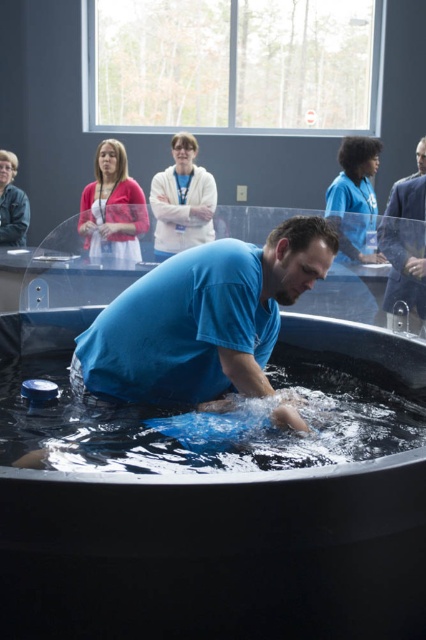
Who is positioned more to the right, matte pink cardigan at upper left or blue smooth shirt at right?

Positioned to the right is blue smooth shirt at right.

Is matte pink cardigan at upper left taller than blue smooth shirt at right?

Incorrect, matte pink cardigan at upper left's height is not larger of blue smooth shirt at right's.

Which is in front, point (92, 198) or point (420, 294)?

Positioned in front is point (420, 294).

The width and height of the screenshot is (426, 640). I want to click on matte pink cardigan at upper left, so click(x=112, y=205).

Is blue matte shirt at center smaller than blue smooth shirt at right?

Yes, blue matte shirt at center is smaller than blue smooth shirt at right.

Which is in front, point (256, 300) or point (420, 278)?

Point (256, 300) is more forward.

You are a GUI agent. You are given a task and a screenshot of the screen. Output one action in this format:
    pyautogui.click(x=<x>, y=<y>)
    Task: Click on the blue matte shirt at center
    The width and height of the screenshot is (426, 640).
    Given the screenshot: What is the action you would take?
    point(201,321)

Which is more to the right, blue matte shirt at center or matte pink cardigan at upper left?

From the viewer's perspective, blue matte shirt at center appears more on the right side.

In the scene shown: Is the position of blue matte shirt at center less distant than that of matte pink cardigan at upper left?

That is True.

Where is `blue matte shirt at center`? blue matte shirt at center is located at coordinates (201, 321).